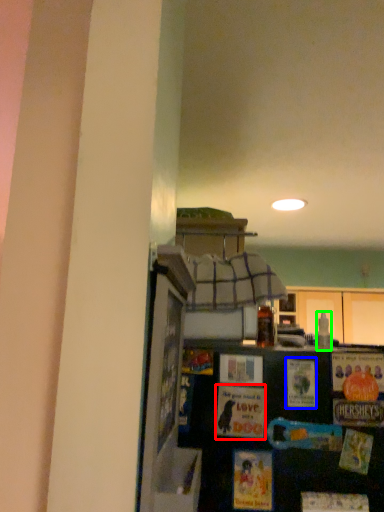
Question: Which object is the farthest from postcard (highlighted by a red box)? Choose among these: postcard (highlighted by a blue box) or bottle (highlighted by a green box).

Choices:
 (A) postcard
 (B) bottle

Answer: (B)